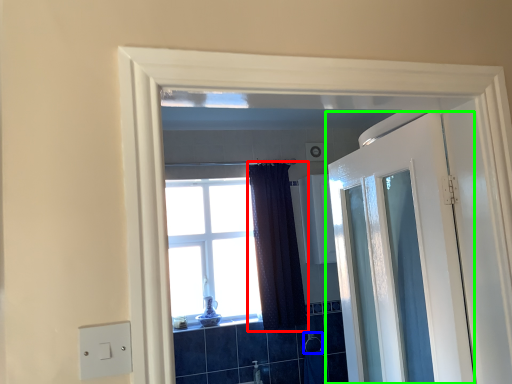
Question: Which object is the closest to the curtain (highlighted by a red box)? Choose among these: towel bar (highlighted by a blue box) or door (highlighted by a green box).

Choices:
 (A) towel bar
 (B) door

Answer: (A)